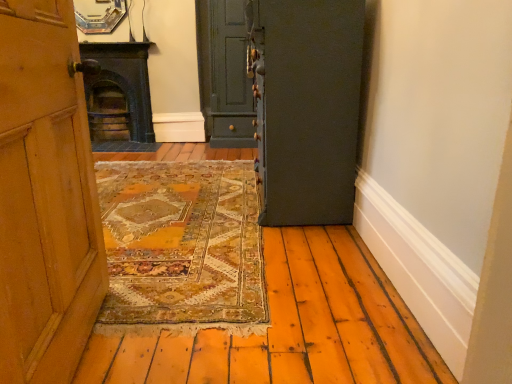
Question: Can you confirm if dark gray matte door at center, which appears as the 1th door when viewed from the right, is smaller than matte green door at center, placed as the first door when sorted from back to front?

Choices:
 (A) no
 (B) yes

Answer: (A)

Question: From a real-world perspective, is dark gray matte door at center, which appears as the 1th door when viewed from the right, on top of matte green door at center, placed as the second door when sorted from right to left?

Choices:
 (A) yes
 (B) no

Answer: (B)

Question: Would you say dark gray matte door at center, the 2th door viewed from the back, is a long distance from matte green door at center, placed as the second door when sorted from right to left?

Choices:
 (A) no
 (B) yes

Answer: (B)

Question: Is dark gray matte door at center, the 1th door from the front, closer to camera compared to matte green door at center, placed as the second door when sorted from right to left?

Choices:
 (A) yes
 (B) no

Answer: (A)

Question: Are dark gray matte door at center, which ranks as the 2th door in left-to-right order, and matte green door at center, marked as the second door in a front-to-back arrangement, making contact?

Choices:
 (A) yes
 (B) no

Answer: (B)

Question: From a real-world perspective, is dark green stone fireplace at left above or below matte green door at center, which ranks as the 1th door in left-to-right order?

Choices:
 (A) above
 (B) below

Answer: (B)

Question: Considering their positions, is dark green stone fireplace at left located in front of or behind matte green door at center, placed as the second door when sorted from right to left?

Choices:
 (A) behind
 (B) front

Answer: (A)

Question: Considering the positions of dark green stone fireplace at left and matte green door at center, which ranks as the 1th door in left-to-right order, in the image, is dark green stone fireplace at left taller or shorter than matte green door at center, which ranks as the 1th door in left-to-right order,?

Choices:
 (A) short
 (B) tall

Answer: (A)

Question: Based on their positions, is dark green stone fireplace at left located to the left or right of matte green door at center, marked as the second door in a front-to-back arrangement?

Choices:
 (A) left
 (B) right

Answer: (A)

Question: In terms of width, does matte green door at center, placed as the first door when sorted from back to front, look wider or thinner when compared to dark green stone fireplace at left?

Choices:
 (A) wide
 (B) thin

Answer: (A)

Question: Considering the positions of matte green door at center, placed as the second door when sorted from right to left, and dark green stone fireplace at left in the image, is matte green door at center, placed as the second door when sorted from right to left, taller or shorter than dark green stone fireplace at left?

Choices:
 (A) short
 (B) tall

Answer: (B)

Question: Is matte green door at center, which ranks as the 1th door in left-to-right order, situated inside dark green stone fireplace at left or outside?

Choices:
 (A) outside
 (B) inside

Answer: (A)

Question: Does point (240, 34) appear closer or farther from the camera than point (112, 120)?

Choices:
 (A) closer
 (B) farther

Answer: (A)

Question: Relative to dark gray matte door at center, the 1th door from the front, is matte green door at center, which ranks as the 1th door in left-to-right order, in front or behind?

Choices:
 (A) front
 (B) behind

Answer: (B)

Question: Is point (230, 76) positioned closer to the camera than point (331, 9)?

Choices:
 (A) closer
 (B) farther

Answer: (B)